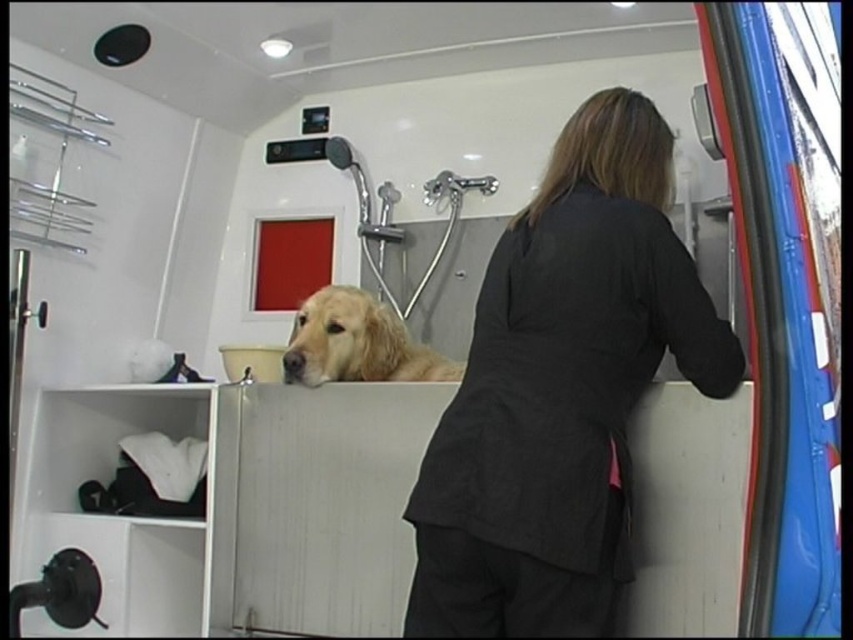
Does dark gray fabric coat at center have a smaller size compared to golden fur dog at center?

Actually, dark gray fabric coat at center might be larger than golden fur dog at center.

Which is above, dark gray fabric coat at center or golden fur dog at center?

Positioned higher is golden fur dog at center.

Is point (465, 577) in front of point (302, 305)?

That is True.

Where is `dark gray fabric coat at center`? dark gray fabric coat at center is located at coordinates (561, 388).